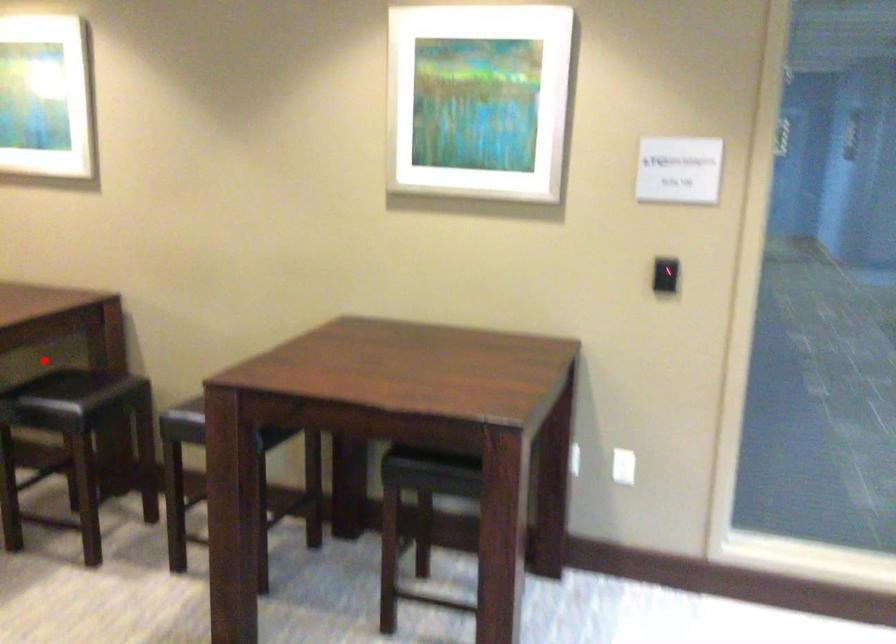
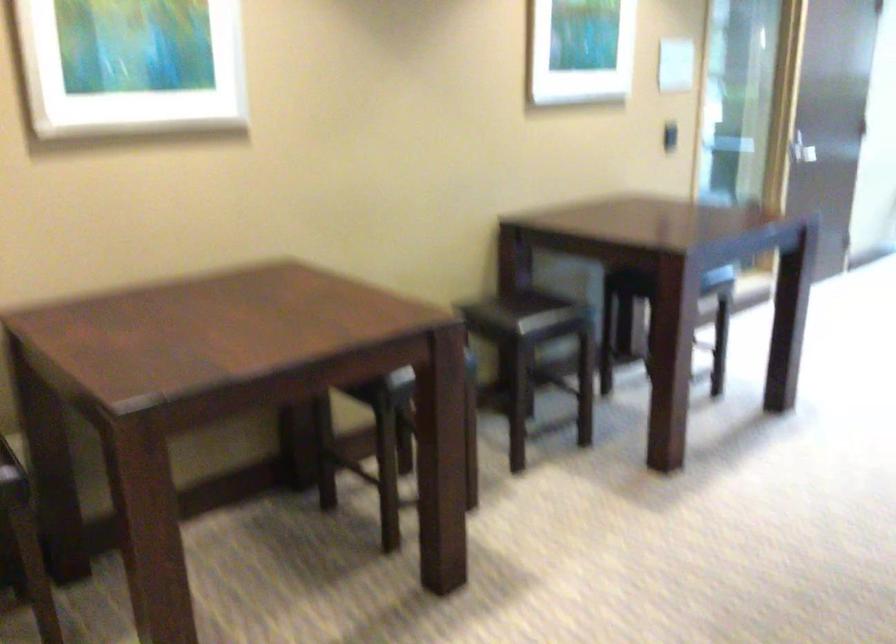
Question: I am providing you with two images of the same scene from different viewpoints. A red point is marked on the first image. Can you still see the location of the red point in image 2?

Choices:
 (A) Yes
 (B) No

Answer: (B)